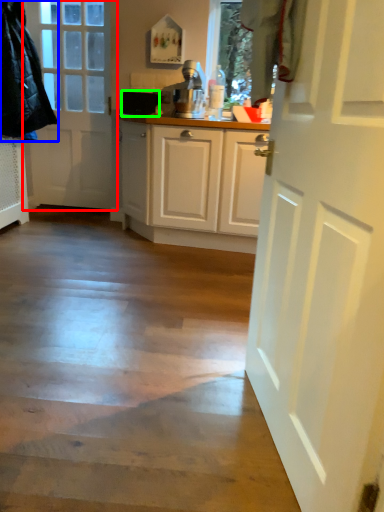
Question: Based on their relative distances, which object is nearer to door (highlighted by a red box)? Choose from jacket (highlighted by a blue box) and appliance (highlighted by a green box).

Choices:
 (A) jacket
 (B) appliance

Answer: (A)